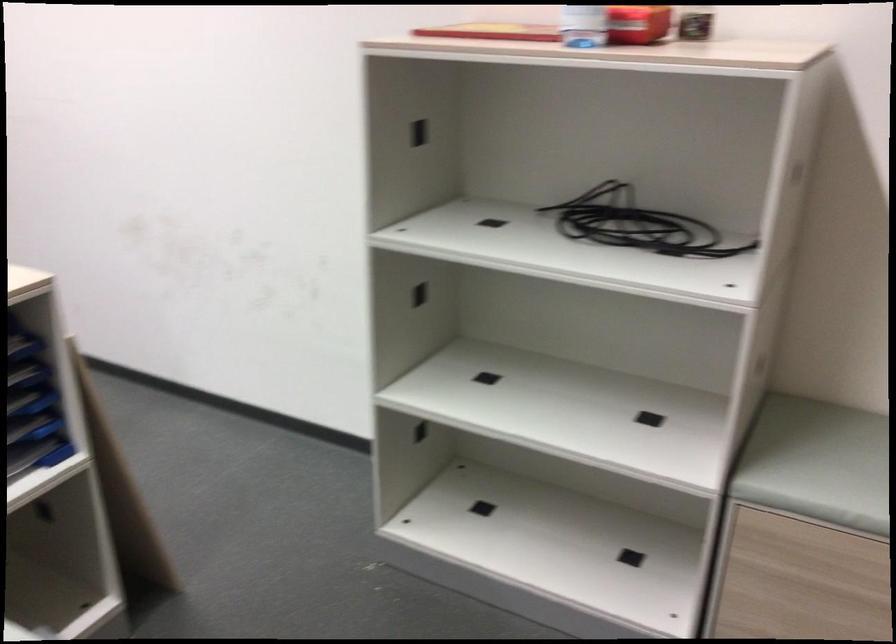
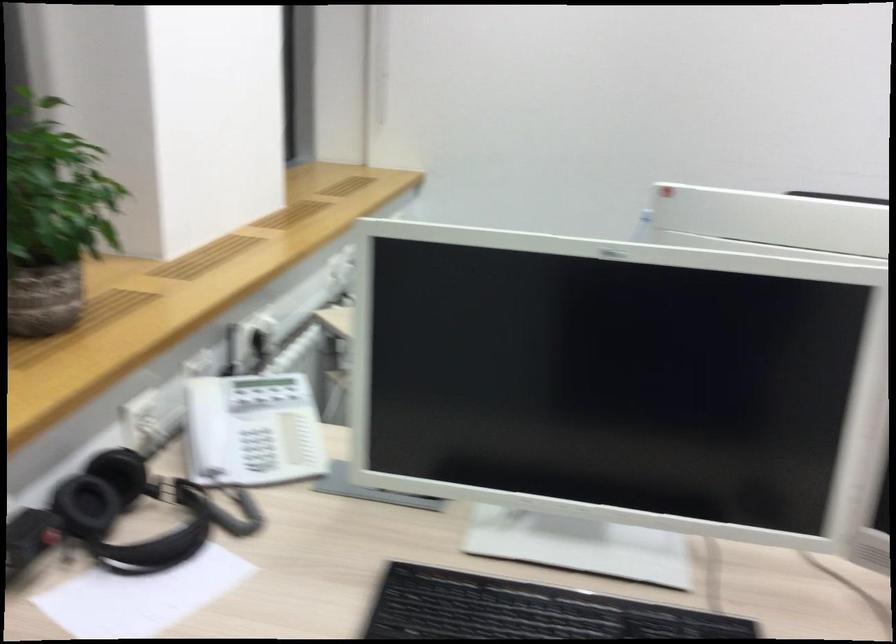
Question: The images are taken continuously from a first-person perspective. In which direction are you moving?

Choices:
 (A) Left
 (B) Right
 (C) Forward
 (D) Backward

Answer: (A)